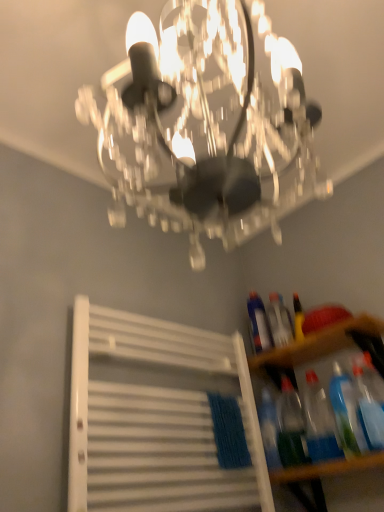
Locate an element on the screen. white matte radiator at lower left is located at coordinates (161, 418).

This screenshot has height=512, width=384. What do you see at coordinates (319, 422) in the screenshot?
I see `translucent plastic bottle at lower right, the 2th bottle positioned from the front` at bounding box center [319, 422].

This screenshot has height=512, width=384. I want to click on translucent plastic bottles at lower right, which is counted as the first bottle, starting from the front, so click(x=346, y=413).

Describe the element at coordinates (346, 413) in the screenshot. I see `translucent plastic bottles at lower right, marked as the 5th bottle in a back-to-front arrangement` at that location.

You are a GUI agent. You are given a task and a screenshot of the screen. Output one action in this format:
    pyautogui.click(x=<x>, y=<y>)
    Task: Click on the transparent plastic bottles at lower right
    This screenshot has height=512, width=384.
    Given the screenshot: What is the action you would take?
    pyautogui.click(x=326, y=345)

Between point (274, 360) and point (252, 332), which one is positioned behind?

The point (252, 332) is behind.

Is transparent plastic bottles at lower right looking in the opposite direction of translucent plastic bottle at right, which is counted as the fifth bottle, starting from the front?

No, translucent plastic bottle at right, which is counted as the fifth bottle, starting from the front, is not at the back of transparent plastic bottles at lower right.

Considering the sizes of objects transparent plastic bottles at lower right and translucent plastic bottle at right, positioned as the 1th bottle in back-to-front order, in the image provided, who is wider, transparent plastic bottles at lower right or translucent plastic bottle at right, positioned as the 1th bottle in back-to-front order,?

transparent plastic bottles at lower right is wider.

Locate an element on the screen. shelf that is under the translucent plastic bottle at right, which is counted as the fifth bottle, starting from the front (from a real-world perspective) is located at coordinates (326, 345).

In the scene shown: Is translucent plastic bottle at lower right, placed as the 4th bottle when sorted from back to front, positioned far away from translucent plastic bottle at right, which appears as the 2th bottle when viewed from the back?

That's not correct — translucent plastic bottle at lower right, placed as the 4th bottle when sorted from back to front, is a little close to translucent plastic bottle at right, which appears as the 2th bottle when viewed from the back.

From the image's perspective, between translucent plastic bottle at lower right, placed as the 4th bottle when sorted from back to front, and translucent plastic bottle at right, which appears as the 2th bottle when viewed from the back, which one is located above?

From the image's view, translucent plastic bottle at right, which appears as the 2th bottle when viewed from the back, is above.

Between translucent plastic bottle at lower right, the 2th bottle positioned from the front, and translucent plastic bottle at right, which appears as the 2th bottle when viewed from the back, which one is positioned behind?

translucent plastic bottle at right, which appears as the 2th bottle when viewed from the back, is more distant.

Considering the sizes of translucent plastic bottle at lower right, the 2th bottle positioned from the front, and translucent plastic bottle at right, which appears as the 2th bottle when viewed from the back, in the image, is translucent plastic bottle at lower right, the 2th bottle positioned from the front, taller or shorter than translucent plastic bottle at right, which appears as the 2th bottle when viewed from the back,?

In the image, translucent plastic bottle at lower right, the 2th bottle positioned from the front, appears to be taller than translucent plastic bottle at right, which appears as the 2th bottle when viewed from the back.

Can you confirm if translucent plastic bottles at lower right, marked as the 5th bottle in a back-to-front arrangement, is wider than clear crystal chandelier at upper center?

No, translucent plastic bottles at lower right, marked as the 5th bottle in a back-to-front arrangement, is not wider than clear crystal chandelier at upper center.

How far apart are translucent plastic bottles at lower right, marked as the 5th bottle in a back-to-front arrangement, and clear crystal chandelier at upper center?

translucent plastic bottles at lower right, marked as the 5th bottle in a back-to-front arrangement, is 1.01 meters from clear crystal chandelier at upper center.

How different are the orientations of translucent plastic bottles at lower right, marked as the 5th bottle in a back-to-front arrangement, and clear crystal chandelier at upper center in degrees?

151 degrees separate the facing orientations of translucent plastic bottles at lower right, marked as the 5th bottle in a back-to-front arrangement, and clear crystal chandelier at upper center.

Considering the positions of objects translucent plastic bottles at lower right, marked as the 5th bottle in a back-to-front arrangement, and clear crystal chandelier at upper center in the image provided, who is more to the right, translucent plastic bottles at lower right, marked as the 5th bottle in a back-to-front arrangement, or clear crystal chandelier at upper center?

From the viewer's perspective, translucent plastic bottles at lower right, marked as the 5th bottle in a back-to-front arrangement, appears more on the right side.

Is translucent plastic bottle at lower right, placed as the 4th bottle when sorted from back to front, inside or outside of wooden table at lower right?

translucent plastic bottle at lower right, placed as the 4th bottle when sorted from back to front, is located beyond the bounds of wooden table at lower right.

Looking at the image, does translucent plastic bottle at lower right, the 2th bottle positioned from the front, seem bigger or smaller compared to wooden table at lower right?

Considering their sizes, translucent plastic bottle at lower right, the 2th bottle positioned from the front, takes up less space than wooden table at lower right.

Considering the relative sizes of translucent plastic bottle at lower right, placed as the 4th bottle when sorted from back to front, and wooden table at lower right in the image provided, is translucent plastic bottle at lower right, placed as the 4th bottle when sorted from back to front, shorter than wooden table at lower right?

Incorrect, the height of translucent plastic bottle at lower right, placed as the 4th bottle when sorted from back to front, does not fall short of that of wooden table at lower right.

Is point (311, 446) closer to viewer compared to point (322, 493)?

Yes, it is in front of point (322, 493).

Is translucent plastic bottle at right, which is the 4th bottle in front-to-back order, surrounded by wooden table at lower right?

That's incorrect, translucent plastic bottle at right, which is the 4th bottle in front-to-back order, is not inside wooden table at lower right.

Considering the sizes of objects wooden table at lower right and translucent plastic bottle at right, which is the 4th bottle in front-to-back order, in the image provided, who is bigger, wooden table at lower right or translucent plastic bottle at right, which is the 4th bottle in front-to-back order,?

wooden table at lower right is bigger.

Is wooden table at lower right taller than translucent plastic bottle at right, which is the 4th bottle in front-to-back order?

No.

From a real-world perspective, which is physically above, translucent plastic bottle at right, which is the 4th bottle in front-to-back order, or clear crystal chandelier at upper center?

clear crystal chandelier at upper center is physically above.

Can you confirm if translucent plastic bottle at right, which is the 4th bottle in front-to-back order, is shorter than clear crystal chandelier at upper center?

Yes.

Which bottle is the 4th one when counting from the back of the clear crystal chandelier at upper center? Please provide its 2D coordinates.

[(279, 321)]

Is clear crystal chandelier at upper center at the back of translucent plastic bottle at right, which appears as the 2th bottle when viewed from the back?

No, translucent plastic bottle at right, which appears as the 2th bottle when viewed from the back, is not facing away from clear crystal chandelier at upper center.

Is translucent plastic bottle at lower right, the 2th bottle positioned from the front, positioned far away from translucent plastic bottles at lower right, marked as the 5th bottle in a back-to-front arrangement?

They are positioned close to each other.

Which bottle is the 1st one when counting from the left side of the translucent plastic bottles at lower right, marked as the 5th bottle in a back-to-front arrangement? Please provide its 2D coordinates.

[(319, 422)]

Which object is closer to the camera, translucent plastic bottle at lower right, the 2th bottle positioned from the front, or translucent plastic bottles at lower right, which is counted as the first bottle, starting from the front?

translucent plastic bottles at lower right, which is counted as the first bottle, starting from the front, is in front.

Can you tell me how much translucent plastic bottle at lower right, the 2th bottle positioned from the front, and translucent plastic bottles at lower right, which is counted as the first bottle, starting from the front, differ in facing direction?

The angular difference between translucent plastic bottle at lower right, the 2th bottle positioned from the front, and translucent plastic bottles at lower right, which is counted as the first bottle, starting from the front, is 3.79 degrees.

Locate an element on the screen. The image size is (384, 512). shelf below the translucent plastic bottle at right, positioned as the 1th bottle in back-to-front order (from a real-world perspective) is located at coordinates (326, 345).

The image size is (384, 512). What are the coordinates of `the 3rd bottle below when counting from the translucent plastic bottle at right, which is the 4th bottle in front-to-back order (from the image's perspective)` in the screenshot? It's located at (319, 422).

Which object lies nearer to the anchor point clear crystal chandelier at upper center, white matte radiator at lower left or translucent plastic bottle at lower right, placed as the 4th bottle when sorted from back to front?

Among the two, white matte radiator at lower left is located nearer to clear crystal chandelier at upper center.

Estimate the real-world distances between objects in this image. Which object is further from translucent plastic bottle at lower right, marked as the 3th bottle in a back-to-front arrangement, translucent plastic bottle at right, positioned as the 1th bottle in back-to-front order, or clear crystal chandelier at upper center?

clear crystal chandelier at upper center is further to translucent plastic bottle at lower right, marked as the 3th bottle in a back-to-front arrangement.

Considering their positions, is translucent plastic bottle at right, which is the 4th bottle in front-to-back order, positioned closer to clear crystal chandelier at upper center than translucent plastic bottle at lower right, positioned as the 3th bottle in front-to-back order?

translucent plastic bottle at right, which is the 4th bottle in front-to-back order, is positioned closer to the anchor clear crystal chandelier at upper center.

Estimate the real-world distances between objects in this image. Which object is further from transparent plastic bottles at lower right, translucent plastic bottle at right, which is the 4th bottle in front-to-back order, or translucent plastic bottle at lower right, the 2th bottle positioned from the front?

translucent plastic bottle at lower right, the 2th bottle positioned from the front, is positioned further to the anchor transparent plastic bottles at lower right.

Based on their spatial positions, is translucent plastic bottle at lower right, placed as the 4th bottle when sorted from back to front, or wooden table at lower right further from translucent plastic bottle at right, which appears as the 2th bottle when viewed from the back?

wooden table at lower right is further to translucent plastic bottle at right, which appears as the 2th bottle when viewed from the back.

Estimate the real-world distances between objects in this image. Which object is further from transparent plastic bottles at lower right, translucent plastic bottle at right, which appears as the 2th bottle when viewed from the back, or translucent plastic bottle at lower right, marked as the 3th bottle in a back-to-front arrangement?

translucent plastic bottle at lower right, marked as the 3th bottle in a back-to-front arrangement, is further to transparent plastic bottles at lower right.

Estimate the real-world distances between objects in this image. Which object is closer to translucent plastic bottle at lower right, positioned as the 3th bottle in front-to-back order, translucent plastic bottle at right, positioned as the 1th bottle in back-to-front order, or translucent plastic bottle at lower right, placed as the 4th bottle when sorted from back to front?

Based on the image, translucent plastic bottle at lower right, placed as the 4th bottle when sorted from back to front, appears to be nearer to translucent plastic bottle at lower right, positioned as the 3th bottle in front-to-back order.

Considering their positions, is translucent plastic bottle at lower right, the 2th bottle positioned from the front, positioned further to translucent plastic bottles at lower right, marked as the 5th bottle in a back-to-front arrangement, than clear crystal chandelier at upper center?

The object further to translucent plastic bottles at lower right, marked as the 5th bottle in a back-to-front arrangement, is clear crystal chandelier at upper center.

Locate an element on the screen. Image resolution: width=384 pixels, height=512 pixels. shelf between wooden table at lower right and translucent plastic bottle at right, which is counted as the fifth bottle, starting from the front, from front to back is located at coordinates (326, 345).

Locate an element on the screen. The height and width of the screenshot is (512, 384). shelf between clear crystal chandelier at upper center and translucent plastic bottle at right, positioned as the 1th bottle in back-to-front order, along the z-axis is located at coordinates (326, 345).

At what (x,y) coordinates should I click in order to perform the action: click on shelf between clear crystal chandelier at upper center and translucent plastic bottle at right, which appears as the 2th bottle when viewed from the back, in the front-back direction. Please return your answer as a coordinate pair (x, y). Looking at the image, I should click on (326, 345).

Where is `table between white matte radiator at lower left and translucent plastic bottle at right, which is counted as the fifth bottle, starting from the front, in the front-back direction`? This screenshot has height=512, width=384. table between white matte radiator at lower left and translucent plastic bottle at right, which is counted as the fifth bottle, starting from the front, in the front-back direction is located at coordinates [321, 476].